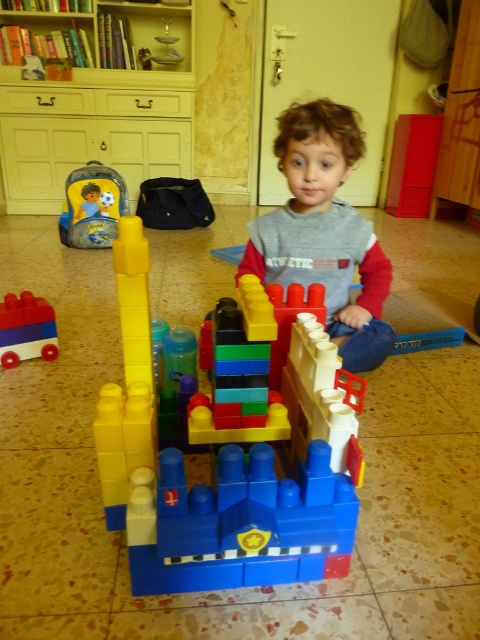
Does brick-like plastic castle at center have a lesser height compared to gray fabric backpack at left?

Incorrect, brick-like plastic castle at center's height does not fall short of gray fabric backpack at left's.

Where is `brick-like plastic castle at center`? brick-like plastic castle at center is located at coordinates (223, 467).

What are the coordinates of `brick-like plastic castle at center` in the screenshot? It's located at (223, 467).

Can you confirm if gray fabric backpack at left is thinner than blue plastic car at center?

No, gray fabric backpack at left is not thinner than blue plastic car at center.

Is point (95, 196) less distant than point (25, 339)?

No.

This screenshot has height=640, width=480. Find the location of `gray fabric backpack at left`. gray fabric backpack at left is located at coordinates (92, 205).

Between point (317, 548) and point (24, 163), which one is positioned in front?

Point (317, 548) is in front.

Is brick-like plastic castle at center wider than yellow wood bookshelf at upper left?

Incorrect, brick-like plastic castle at center's width does not surpass yellow wood bookshelf at upper left's.

Is point (251, 323) in front of point (48, 177)?

Yes, it is in front of point (48, 177).

Find the location of a particular element. The image size is (480, 640). brick-like plastic castle at center is located at coordinates (223, 467).